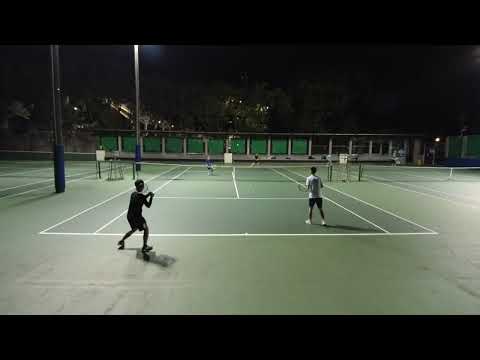
You are a GUI agent. You are given a task and a screenshot of the screen. Output one action in this format:
    pyautogui.click(x=<x>, y=<y>)
    Task: Click on the lights
    Image resolution: width=480 pixels, height=360 pixels.
    Given the screenshot: What is the action you would take?
    pyautogui.click(x=60, y=181)